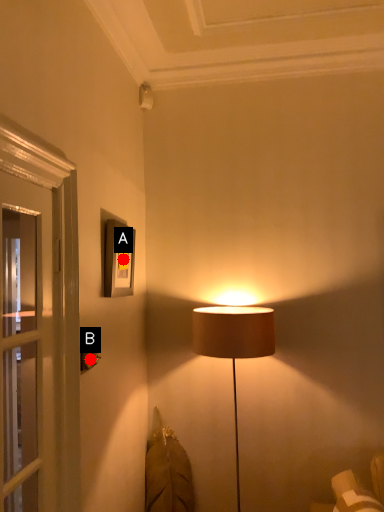
Question: Two points are circled on the image, labeled by A and B beside each circle. Which point appears farthest from the camera in this image?

Choices:
 (A) A is further
 (B) B is further

Answer: (A)